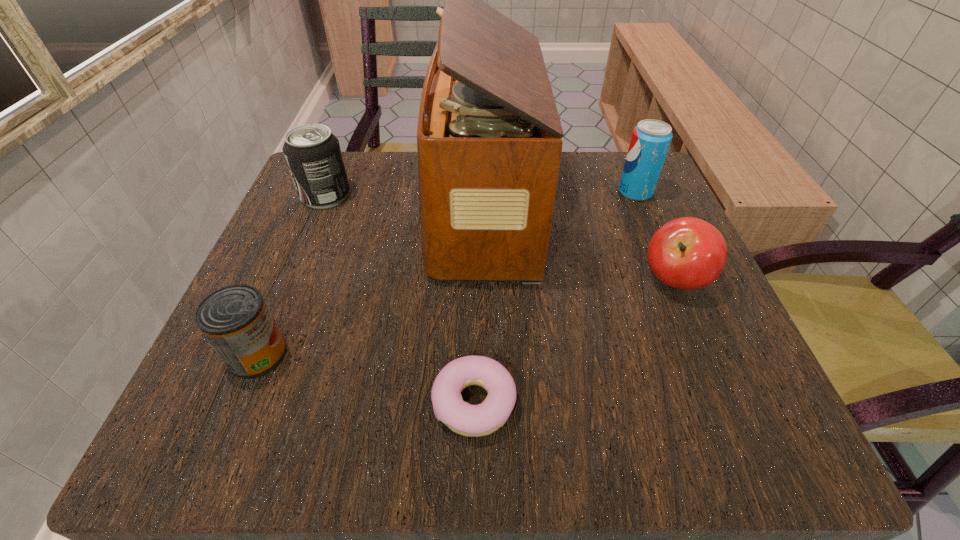
Select which object appears as the third closest to the shortest object. Please provide its 2D coordinates. Your answer should be formatted as a tuple, i.e. [(x, y)], where the tuple contains the x and y coordinates of a point satisfying the conditions above.

[(687, 253)]

Where is `vacant space that satisfies the following two spatial constraints: 1. on the front panel of the apple; 2. on the left side of the radio receiver`? The width and height of the screenshot is (960, 540). vacant space that satisfies the following two spatial constraints: 1. on the front panel of the apple; 2. on the left side of the radio receiver is located at coordinates (481, 280).

The width and height of the screenshot is (960, 540). I want to click on vacant region that satisfies the following two spatial constraints: 1. on the front side of the apple; 2. on the left side of the right soda can, so click(672, 280).

Where is `free space that satisfies the following two spatial constraints: 1. on the front side of the left soda can; 2. on the right side of the doughnut`? This screenshot has width=960, height=540. free space that satisfies the following two spatial constraints: 1. on the front side of the left soda can; 2. on the right side of the doughnut is located at coordinates (241, 403).